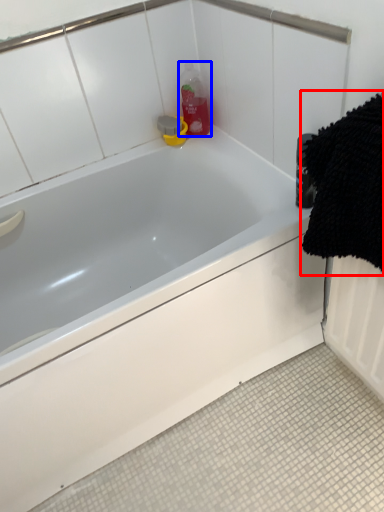
Question: Which object appears farthest to the camera in this image, bath towel (highlighted by a red box) or cleaning product (highlighted by a blue box)?

Choices:
 (A) bath towel
 (B) cleaning product

Answer: (B)